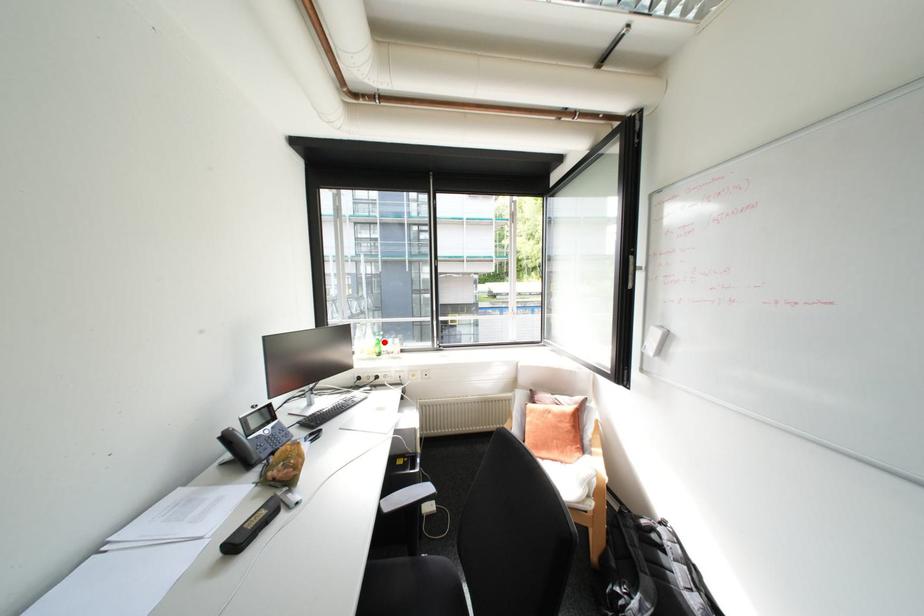
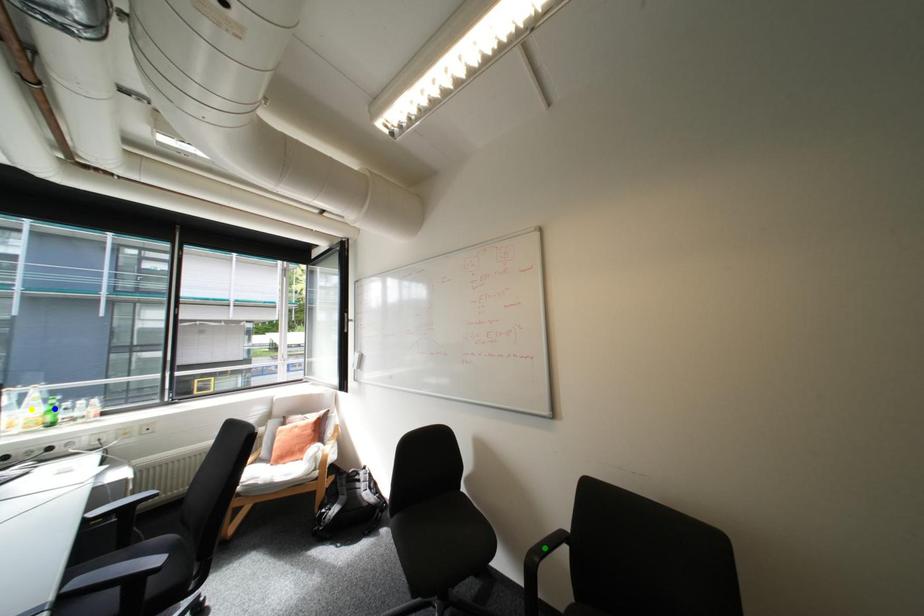
Question: I am providing you with two images of the same scene from different viewpoints. A red point is marked on the first image. You are given multiple points on the second image. Which point in image 2 is actually the same real-world point as the red point in image 1?

Choices:
 (A) green point
 (B) yellow point
 (C) blue point

Answer: (C)